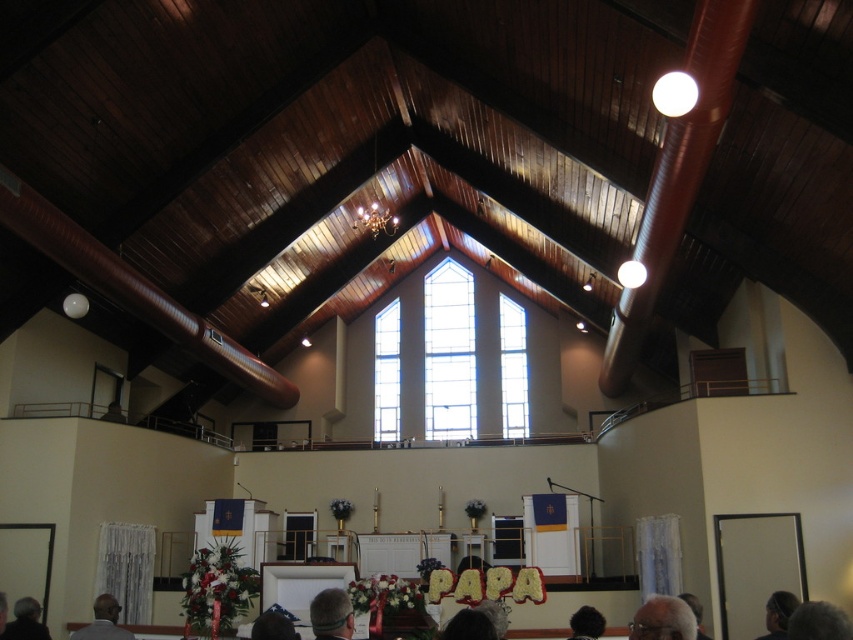
You are an attendee at the memorial service and need to sit between the gray hair at lower right and the black fur hat at lower center. Which object should you sit closer to if you want to be near the narrower one?

The gray hair at lower right has a lesser width compared to the black fur hat at lower center, so you should sit closer to the gray hair at lower right to be near the narrower one.

You are standing at the entrance of the church and notice two items in the foreground. Which one is nearer to you between the gray hair at lower right and the black fur hat at lower center?

The gray hair at lower right is closer to the viewer than the black fur hat at lower center.

You are attending a memorial service in the church and notice two items at the lower center of the altar area. Which item has a smaller width? The items are the gray hair at lower center and the black fur hat at lower center.

The gray hair at lower center has a smaller width than the black fur hat at lower center.